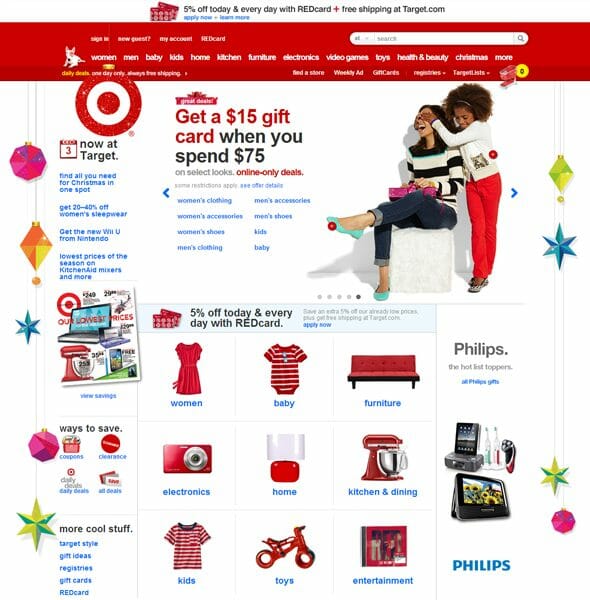
Where is `baskets`? baskets is located at coordinates (508, 74), (68, 442).